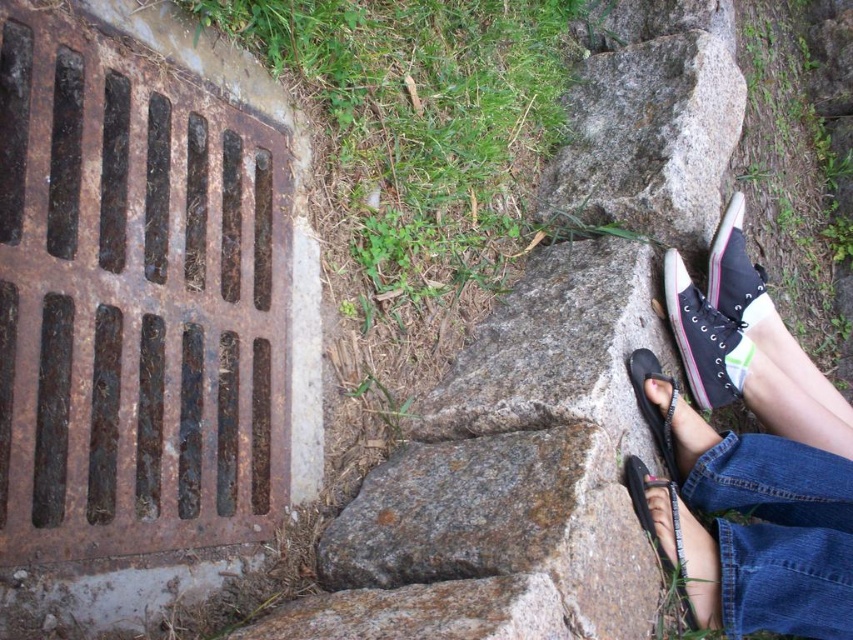
Can you confirm if black canvas sneakers at lower right is positioned to the right of black canvas shoe at right?

Indeed, black canvas sneakers at lower right is positioned on the right side of black canvas shoe at right.

Between black canvas sneakers at lower right and black canvas shoe at right, which one is positioned higher?

black canvas shoe at right is higher up.

Which is behind, point (730, 628) or point (703, 408)?

The point (703, 408) is more distant.

Image resolution: width=853 pixels, height=640 pixels. Identify the location of black canvas sneakers at lower right. (747, 456).

Who is lower down, black canvas sneakers at lower right or black rubber sandal at lower right?

black rubber sandal at lower right is lower down.

Between point (727, 339) and point (679, 417), which one is positioned behind?

The point (727, 339) is behind.

What do you see at coordinates (747, 456) in the screenshot? I see `black canvas sneakers at lower right` at bounding box center [747, 456].

The image size is (853, 640). In order to click on black canvas sneakers at lower right in this screenshot , I will do `click(747, 456)`.

Who is higher up, green grass at upper center or black leather sandal at lower right?

green grass at upper center is above.

Can you confirm if green grass at upper center is shorter than black leather sandal at lower right?

Incorrect, green grass at upper center's height does not fall short of black leather sandal at lower right's.

Does point (456, 275) come farther from viewer compared to point (672, 544)?

Yes, point (456, 275) is farther from viewer.

The height and width of the screenshot is (640, 853). Find the location of `green grass at upper center`. green grass at upper center is located at coordinates (416, 154).